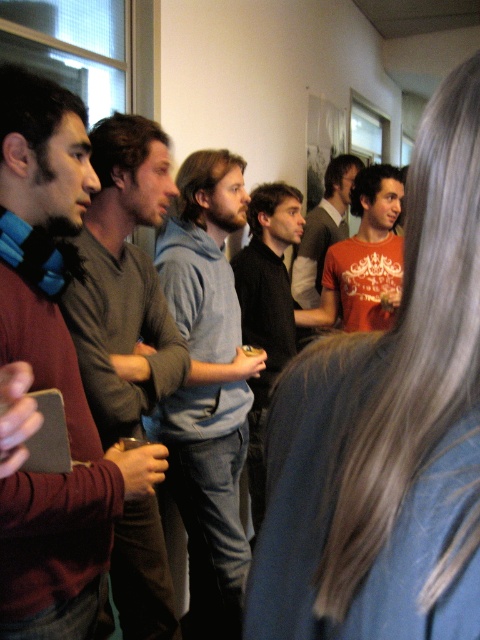
Who is lower down, gray sweater at center or matte orange t-shirt at center?

gray sweater at center is below.

Is gray sweater at center closer to the viewer compared to matte orange t-shirt at center?

Yes, gray sweater at center is closer to the viewer.

The width and height of the screenshot is (480, 640). Describe the element at coordinates (123, 282) in the screenshot. I see `gray sweater at center` at that location.

Where is `gray sweater at center`? gray sweater at center is located at coordinates (123, 282).

Can you confirm if light gray hoodie at center is wider than black matte shirt at center?

Yes.

Where is `light gray hoodie at center`? Image resolution: width=480 pixels, height=640 pixels. light gray hoodie at center is located at coordinates (207, 387).

What do you see at coordinates (266, 308) in the screenshot?
I see `black matte shirt at center` at bounding box center [266, 308].

Where is `black matte shirt at center`? The image size is (480, 640). black matte shirt at center is located at coordinates (266, 308).